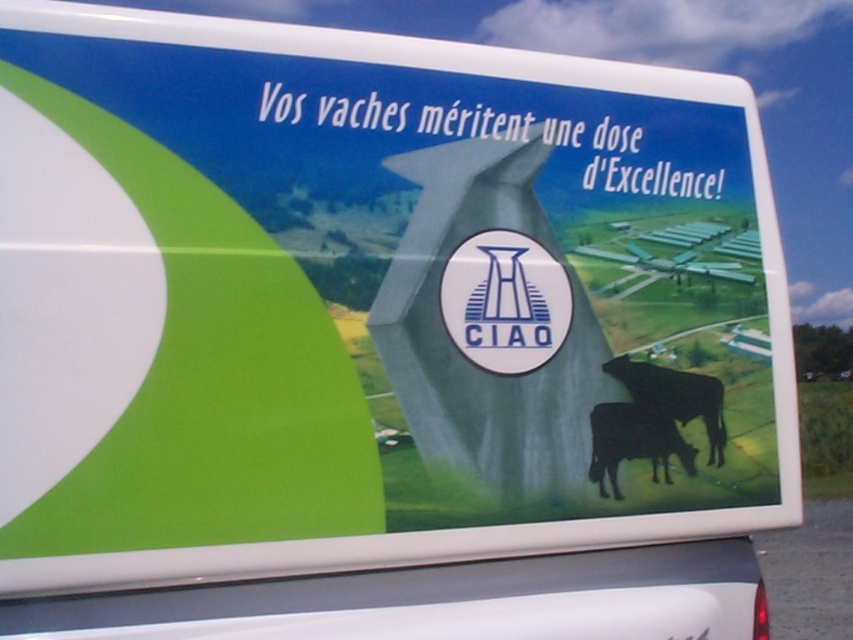
Does black glossy bull at lower right have a larger size compared to black matte bull at lower right?

No.

Who is more distant from viewer, (606, 465) or (701, 396)?

The point (701, 396) is behind.

This screenshot has height=640, width=853. Identify the location of black glossy bull at lower right. (633, 442).